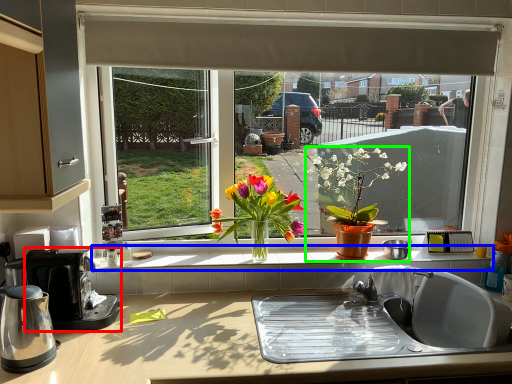
Question: Which object is positioned closest to coffee maker (highlighted by a red box)? Select from window sill (highlighted by a blue box) and houseplant (highlighted by a green box).

Choices:
 (A) window sill
 (B) houseplant

Answer: (A)